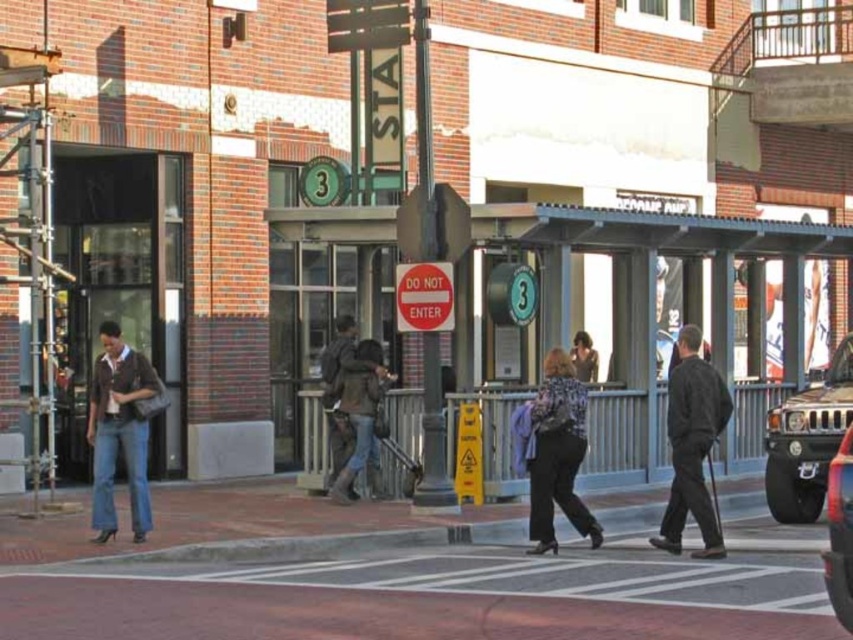
Does smooth concrete pavement at center have a lesser height compared to metallic silver suv at lower right?

Yes, smooth concrete pavement at center is shorter than metallic silver suv at lower right.

Find the location of a particular element. The image size is (853, 640). smooth concrete pavement at center is located at coordinates (433, 598).

Is brown leather jacket at center closer to camera compared to dark brown leather jacket at center?

Yes, brown leather jacket at center is in front of dark brown leather jacket at center.

Between brown leather jacket at center and dark brown leather jacket at center, which one is positioned higher?

dark brown leather jacket at center

Find the location of `brown leather jacket at center`. brown leather jacket at center is located at coordinates (360, 417).

Which is below, brushed metal jeep at right or metallic silver suv at lower right?

metallic silver suv at lower right is below.

Is brushed metal jeep at right closer to camera compared to metallic silver suv at lower right?

No, it is behind metallic silver suv at lower right.

Is point (827, 461) positioned behind point (849, 564)?

Yes, point (827, 461) is farther from viewer.

The image size is (853, 640). Find the location of `brushed metal jeep at right`. brushed metal jeep at right is located at coordinates (807, 440).